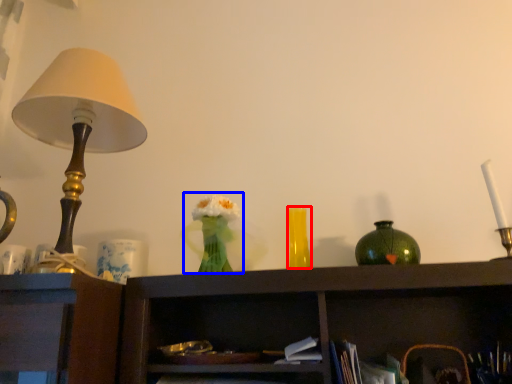
Question: Which point is closer to the camera, vase (highlighted by a red box) or floral arrangement (highlighted by a blue box)?

Choices:
 (A) vase
 (B) floral arrangement

Answer: (B)